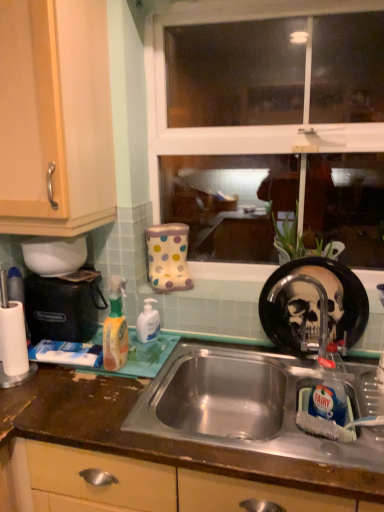
Image resolution: width=384 pixels, height=512 pixels. Find the location of `free spot above brown laminate countertop at center (from a real-world perspective)`. free spot above brown laminate countertop at center (from a real-world perspective) is located at coordinates (152, 392).